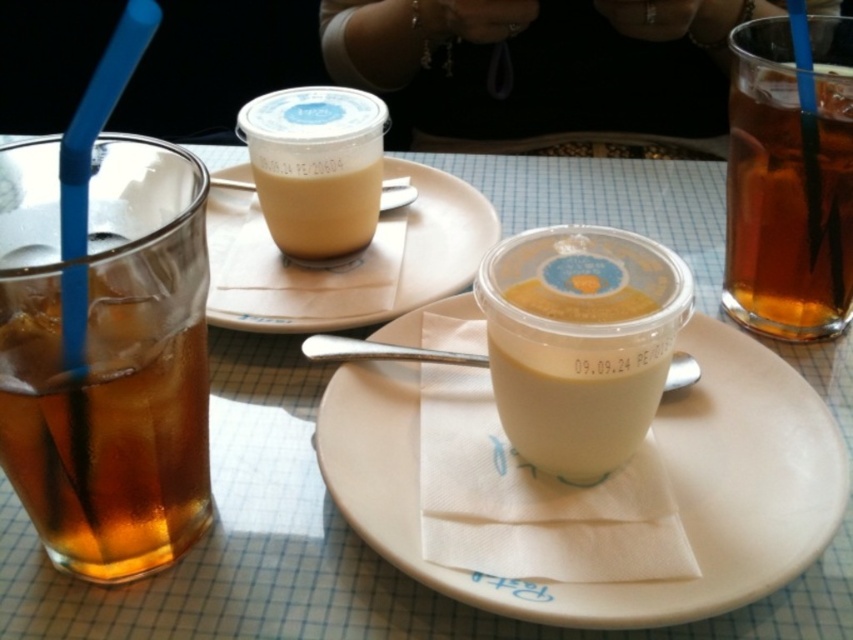
You are a customer at the table and want to place your phone on the white ceramic plate at center. Is the plate large enough to hold your phone?

The white ceramic plate at center is positioned at point (x=666, y=467), but there is no information provided about its size. Therefore, it is unclear if the plate can accommodate your phone.

You are a server at the restaurant and need to place a dessert plate that is 12 inches in diameter on the table. The dessert plate is larger than the white ceramic plate at center. Can the dessert plate fit on the table without overlapping the brown translucent glass at right?

The white ceramic plate at center has a larger size compared to brown translucent glass at right. Since the dessert plate is larger than the white ceramic plate at center, it will also be larger than the brown translucent glass at right. However, the exact spacing between the two objects isn

What is located at the point with coordinates (x=111, y=412) in the image?

The point at coordinates (x=111, y=412) indicates the location of the brown translucent glass at left.